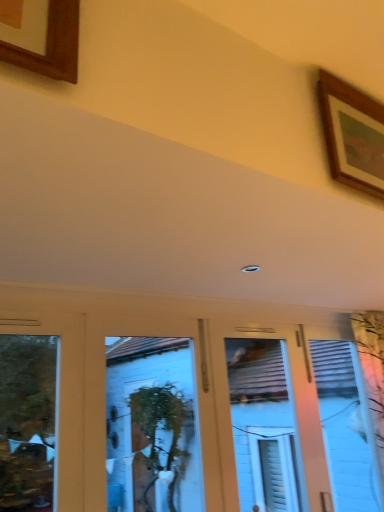
Question: Considering the relative sizes of white glossy door at center and wooden picture frame at upper right in the image provided, is white glossy door at center shorter than wooden picture frame at upper right?

Choices:
 (A) no
 (B) yes

Answer: (A)

Question: From the image's perspective, is white glossy door at center located above wooden picture frame at upper right?

Choices:
 (A) yes
 (B) no

Answer: (B)

Question: Is white glossy door at center taller than wooden picture frame at upper right?

Choices:
 (A) yes
 (B) no

Answer: (A)

Question: Is white glossy door at center not inside wooden picture frame at upper right?

Choices:
 (A) yes
 (B) no

Answer: (A)

Question: Is white glossy door at center further to the viewer compared to wooden picture frame at upper right?

Choices:
 (A) no
 (B) yes

Answer: (B)

Question: Is there a large distance between white glossy door at center and wooden picture frame at upper right?

Choices:
 (A) no
 (B) yes

Answer: (B)

Question: Considering the relative sizes of wooden picture frame at upper right and white glossy door at center in the image provided, is wooden picture frame at upper right bigger than white glossy door at center?

Choices:
 (A) no
 (B) yes

Answer: (A)

Question: From a real-world perspective, is wooden picture frame at upper right on top of white glossy door at center?

Choices:
 (A) yes
 (B) no

Answer: (A)

Question: From the image's perspective, is wooden picture frame at upper right beneath white glossy door at center?

Choices:
 (A) no
 (B) yes

Answer: (A)

Question: Is wooden picture frame at upper right to the right of white glossy door at center from the viewer's perspective?

Choices:
 (A) no
 (B) yes

Answer: (B)

Question: Would you say wooden picture frame at upper right is outside white glossy door at center?

Choices:
 (A) no
 (B) yes

Answer: (B)

Question: Is wooden picture frame at upper right thinner than white glossy door at center?

Choices:
 (A) no
 (B) yes

Answer: (B)

Question: Do you think white glossy door at center is within wooden picture frame at upper right, or outside of it?

Choices:
 (A) outside
 (B) inside

Answer: (A)